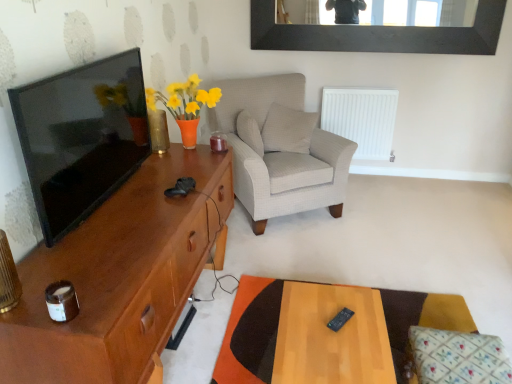
The height and width of the screenshot is (384, 512). What are the coordinates of `vacant space in between floral fabric cushion at lower right, marked as the third pillow in a top-to-bottom arrangement, and light gray fabric armchair at center` in the screenshot? It's located at (348, 266).